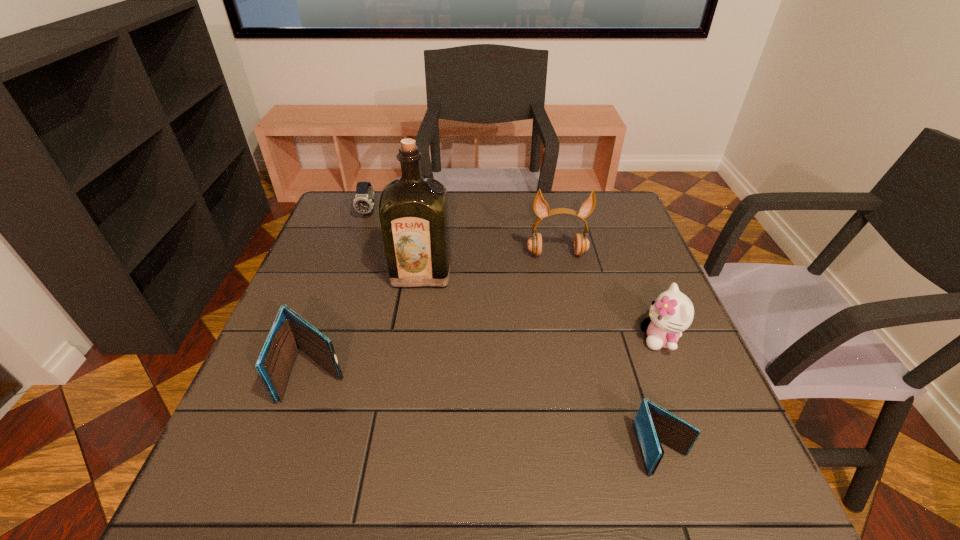
Where is `free spot between the tallest object and the shorter wallet`? The width and height of the screenshot is (960, 540). free spot between the tallest object and the shorter wallet is located at coordinates (542, 361).

The height and width of the screenshot is (540, 960). What are the coordinates of `empty space that is in between the second tallest object and the watch` in the screenshot? It's located at (463, 234).

Locate an element on the screen. The image size is (960, 540). free area in between the second tallest object and the kitten is located at coordinates (609, 296).

This screenshot has height=540, width=960. I want to click on vacant region between the kitten and the watch, so click(515, 276).

You are a GUI agent. You are given a task and a screenshot of the screen. Output one action in this format:
    pyautogui.click(x=<x>, y=<y>)
    Task: Click on the blank region between the liquor and the right wallet
    
    Given the screenshot: What is the action you would take?
    pyautogui.click(x=542, y=361)

Identify the location of empty space between the farther wallet and the farthest object. (343, 293).

Identify the location of free space between the earphone and the second shortest object. The width and height of the screenshot is (960, 540). (463, 234).

Identify the location of free space between the farther wallet and the right wallet. (490, 411).

You are a GUI agent. You are given a task and a screenshot of the screen. Output one action in this format:
    pyautogui.click(x=<x>, y=<y>)
    Task: Click on the vacant region between the earphone and the nearest object
    The image size is (960, 540).
    Given the screenshot: What is the action you would take?
    pyautogui.click(x=610, y=352)

Find the location of a particular element. The width and height of the screenshot is (960, 540). vacant area between the kitten and the farther wallet is located at coordinates (489, 356).